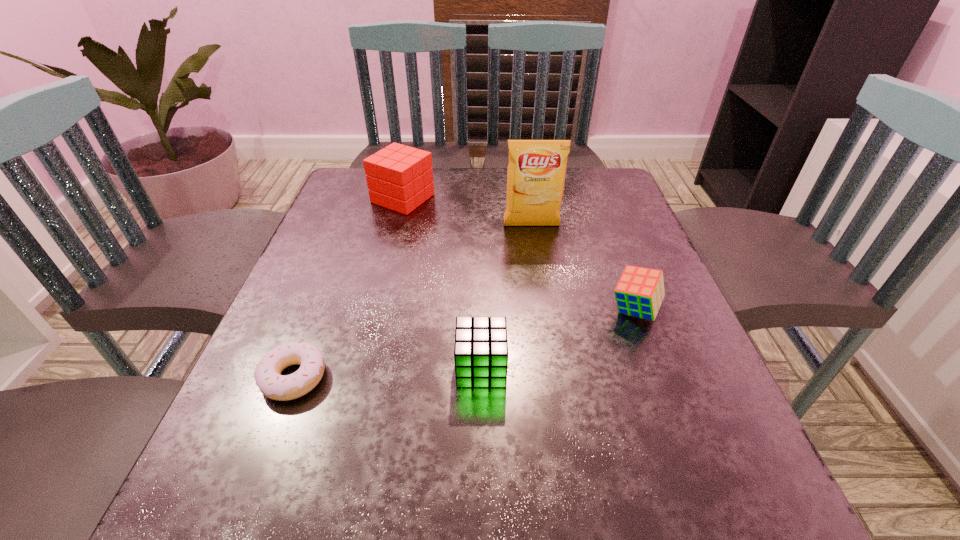
Where is `free location that satisfies the following two spatial constraints: 1. on the back side of the second cube from left to right; 2. on the left side of the third nearest object`? Image resolution: width=960 pixels, height=540 pixels. free location that satisfies the following two spatial constraints: 1. on the back side of the second cube from left to right; 2. on the left side of the third nearest object is located at coordinates (481, 310).

I want to click on vacant space that satisfies the following two spatial constraints: 1. on the front of the fourth nearest object with the logo; 2. on the right side of the third nearest object, so click(x=544, y=310).

Locate an element on the screen. This screenshot has width=960, height=540. free spot that satisfies the following two spatial constraints: 1. on the back side of the third farthest object; 2. on the left side of the nearest cube is located at coordinates (481, 310).